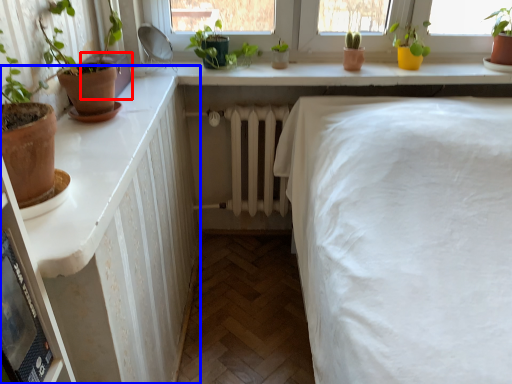
Question: Which object is closer to the camera taking this photo, window box (highlighted by a red box) or dresser (highlighted by a blue box)?

Choices:
 (A) window box
 (B) dresser

Answer: (B)